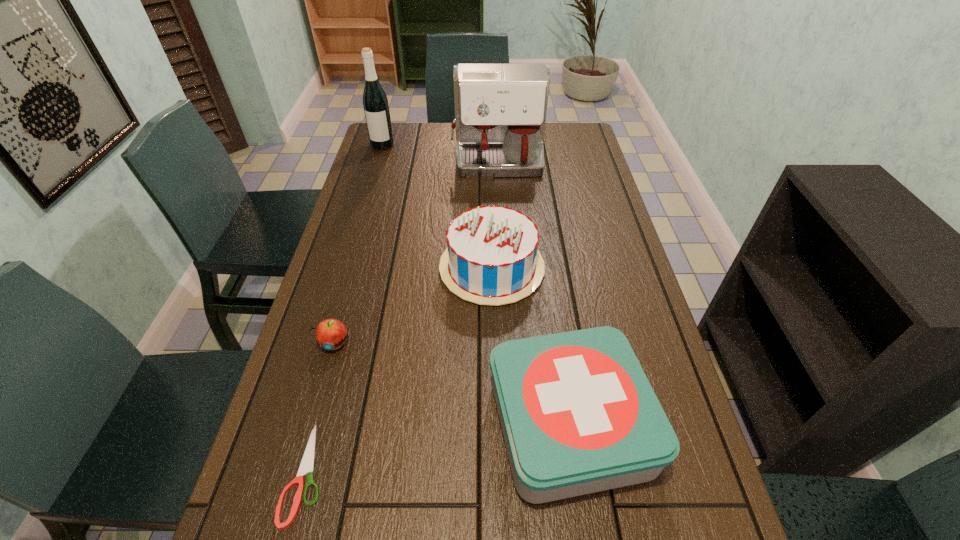
The height and width of the screenshot is (540, 960). Find the location of `object positioned at the far left corner`. object positioned at the far left corner is located at coordinates (375, 103).

This screenshot has width=960, height=540. In the image, there is a desktop. In order to click on vacant space at the far edge in this screenshot , I will do `click(454, 148)`.

Where is `vacant space at the left edge of the desktop`? The width and height of the screenshot is (960, 540). vacant space at the left edge of the desktop is located at coordinates (287, 447).

At what (x,y) coordinates should I click in order to perform the action: click on blank space at the right edge of the desktop. Please return your answer as a coordinate pair (x, y). This screenshot has width=960, height=540. Looking at the image, I should click on [593, 183].

Locate an element on the screen. The image size is (960, 540). free space at the far left corner of the desktop is located at coordinates (412, 125).

At what (x,y) coordinates should I click in order to perform the action: click on free space at the far right corner. Please return your answer as a coordinate pair (x, y). This screenshot has height=540, width=960. Looking at the image, I should click on (564, 133).

Find the location of a particular element. free spot between the scissors and the wine bottle is located at coordinates (345, 309).

At what (x,y) coordinates should I click in order to perform the action: click on free point between the shortest object and the fourth tallest object. Please return your answer as a coordinate pair (x, y). The width and height of the screenshot is (960, 540). Looking at the image, I should click on (438, 449).

Find the location of a particular element. This screenshot has height=540, width=960. unoccupied position between the apple and the fourth nearest object is located at coordinates (413, 305).

Where is `vacant area that lies between the coffee maker and the wine bottle`? The image size is (960, 540). vacant area that lies between the coffee maker and the wine bottle is located at coordinates (441, 154).